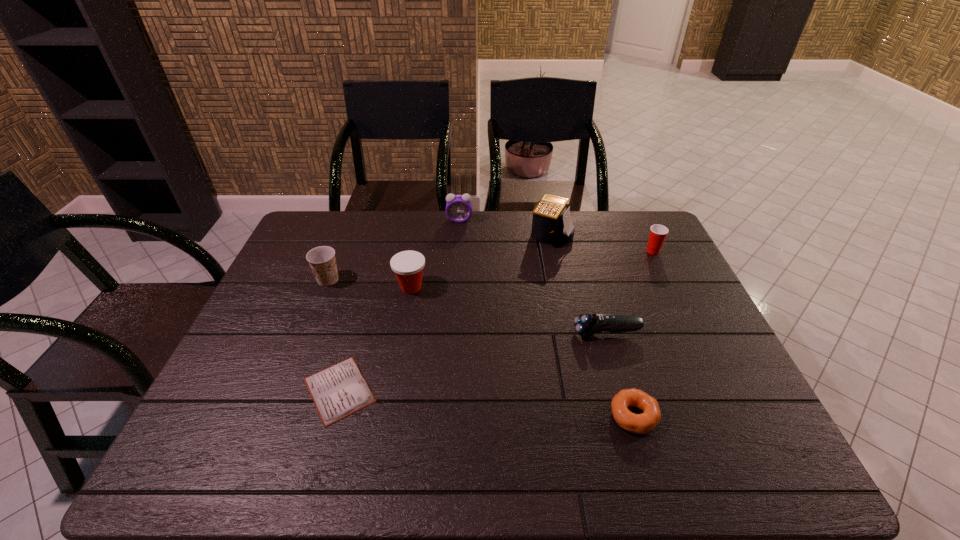
I want to click on free space at the right edge, so click(719, 388).

I want to click on free space at the far left corner, so click(335, 234).

In the image, there is a desktop. Identify the location of vacant space at the near right corner. (709, 467).

The width and height of the screenshot is (960, 540). I want to click on empty space that is in between the second Dixie cup from left to right and the alarm clock, so click(x=435, y=254).

Locate an element on the screen. free area in between the sixth tallest object and the second Dixie cup from right to left is located at coordinates (509, 310).

Identify the location of free point between the electric shaver and the farthest Dixie cup. This screenshot has width=960, height=540. (630, 292).

Where is `vacant area between the alarm clock and the second Dixie cup from right to left`? vacant area between the alarm clock and the second Dixie cup from right to left is located at coordinates (435, 254).

This screenshot has width=960, height=540. I want to click on vacant area that lies between the seventh tallest object and the leftmost Dixie cup, so click(x=481, y=348).

Locate an element on the screen. The width and height of the screenshot is (960, 540). unoccupied area between the second Dixie cup from right to left and the farthest Dixie cup is located at coordinates (532, 269).

Find the location of `unoccupied position between the shortest object and the rightmost Dixie cup`. unoccupied position between the shortest object and the rightmost Dixie cup is located at coordinates (496, 321).